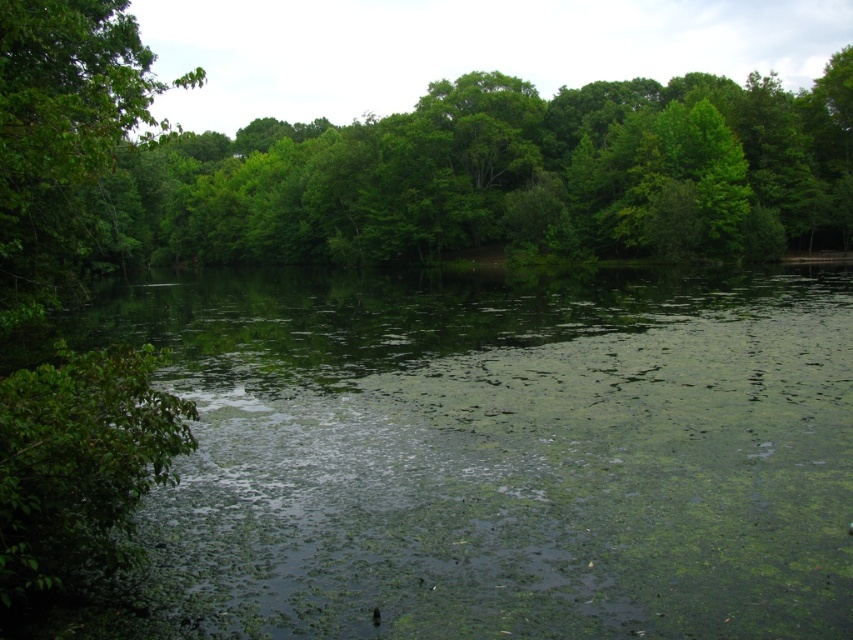
You are planning to build a small garden shed and need to know which area has more space. You see the green leafy forest at center and the green leafy tree at left. Which one has a larger width?

The green leafy forest at center might be wider than green leafy tree at left according to the description.

You are standing at the edge of the water in the serene natural scene. There is a point marked at coordinates point (x=497, y=454). What is located at this point?

The point (x=497, y=454) is where the green algae covered water at center is located.